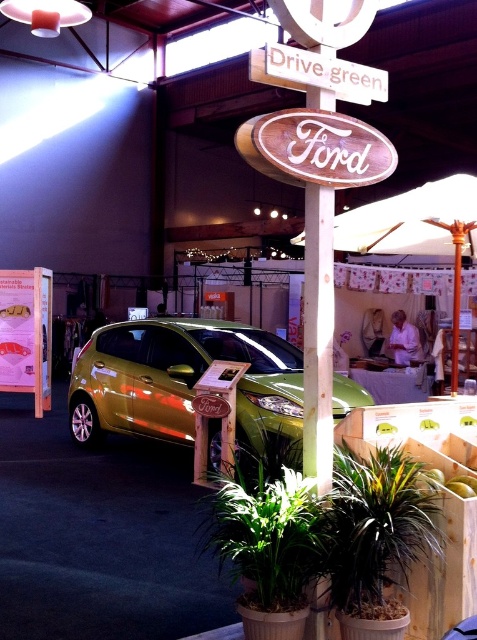
Question: Which object is the farthest from the green leafy plant at lower center?

Choices:
 (A) metallic gold car at center
 (B) white fabric umbrella at upper center
 (C) green leafy plant at center

Answer: (A)

Question: Does metallic gold car at center come behind green leafy plant at lower center?

Choices:
 (A) no
 (B) yes

Answer: (B)

Question: Among these objects, which one is nearest to the camera?

Choices:
 (A) green leafy plant at lower center
 (B) green leafy plant at center
 (C) metallic gold car at center

Answer: (A)

Question: Does green leafy plant at lower center appear over green leafy plant at center?

Choices:
 (A) yes
 (B) no

Answer: (B)

Question: Which point is closer to the camera?

Choices:
 (A) (196, 435)
 (B) (412, 237)
 (C) (184, 371)
 (D) (339, 573)

Answer: (D)

Question: Can you confirm if green leafy plant at center is positioned to the right of white fabric umbrella at upper center?

Choices:
 (A) no
 (B) yes

Answer: (A)